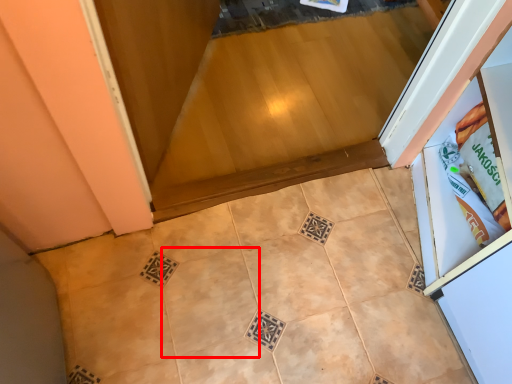
Question: Where is ceramic tile (annotated by the red box) located in relation to ceramic tile in the image?

Choices:
 (A) right
 (B) left

Answer: (B)